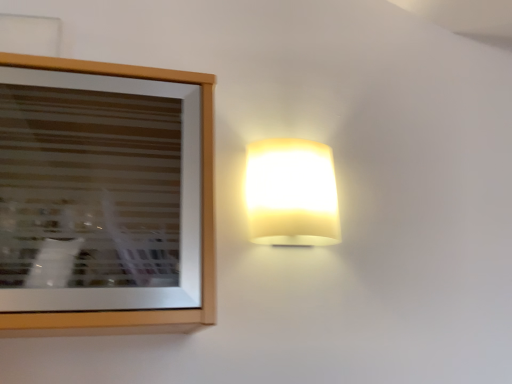
The image size is (512, 384). What do you see at coordinates (291, 193) in the screenshot?
I see `matte yellow glass lamp at upper right` at bounding box center [291, 193].

I want to click on matte yellow glass lamp at upper right, so click(291, 193).

In order to face wooden picture frame at upper left, should I rotate leftwards or rightwards?

Rotate your view left by about 22.306°.

At what (x,y) coordinates should I click in order to perform the action: click on wooden picture frame at upper left. Please return your answer as a coordinate pair (x, y). Looking at the image, I should click on (201, 207).

This screenshot has height=384, width=512. What do you see at coordinates (201, 207) in the screenshot? I see `wooden picture frame at upper left` at bounding box center [201, 207].

Locate an element on the screen. Image resolution: width=512 pixels, height=384 pixels. matte yellow glass lamp at upper right is located at coordinates (291, 193).

Would you say matte yellow glass lamp at upper right is to the left or to the right of wooden picture frame at upper left in the picture?

matte yellow glass lamp at upper right is positioned on wooden picture frame at upper left's right side.

Is the depth of matte yellow glass lamp at upper right greater than that of wooden picture frame at upper left?

That is True.

Which point is more forward, (316, 244) or (209, 99)?

The point (209, 99) is in front.

From the image's perspective, is matte yellow glass lamp at upper right above or below wooden picture frame at upper left?

From the image's perspective, matte yellow glass lamp at upper right appears above wooden picture frame at upper left.

From a real-world perspective, is matte yellow glass lamp at upper right physically located above or below wooden picture frame at upper left?

From a real-world perspective, matte yellow glass lamp at upper right is physically above wooden picture frame at upper left.

Does matte yellow glass lamp at upper right have a lesser width compared to wooden picture frame at upper left?

Correct, the width of matte yellow glass lamp at upper right is less than that of wooden picture frame at upper left.

Can you confirm if matte yellow glass lamp at upper right is shorter than wooden picture frame at upper left?

Indeed, matte yellow glass lamp at upper right has a lesser height compared to wooden picture frame at upper left.

Is matte yellow glass lamp at upper right bigger than wooden picture frame at upper left?

No, matte yellow glass lamp at upper right is not bigger than wooden picture frame at upper left.

Is matte yellow glass lamp at upper right positioned beyond the bounds of wooden picture frame at upper left?

Yes, matte yellow glass lamp at upper right is not within wooden picture frame at upper left.

Is matte yellow glass lamp at upper right positioned far away from wooden picture frame at upper left?

matte yellow glass lamp at upper right is actually quite close to wooden picture frame at upper left.

Does matte yellow glass lamp at upper right turn towards wooden picture frame at upper left?

No, matte yellow glass lamp at upper right is not oriented towards wooden picture frame at upper left.

The image size is (512, 384). Identify the location of lamp lying behind the wooden picture frame at upper left. (291, 193).

Is wooden picture frame at upper left to the left or to the right of matte yellow glass lamp at upper right in the image?

From the image, it's evident that wooden picture frame at upper left is to the left of matte yellow glass lamp at upper right.

Which object is closer to the camera, wooden picture frame at upper left or matte yellow glass lamp at upper right?

wooden picture frame at upper left is closer to the camera.

Considering the positions of point (206, 250) and point (321, 190), is point (206, 250) closer or farther from the camera than point (321, 190)?

Point (206, 250).

From the image's perspective, which object appears higher, wooden picture frame at upper left or matte yellow glass lamp at upper right?

matte yellow glass lamp at upper right is shown above in the image.

From a real-world perspective, is wooden picture frame at upper left under matte yellow glass lamp at upper right?

Correct, in the physical world, wooden picture frame at upper left is lower than matte yellow glass lamp at upper right.

Is wooden picture frame at upper left thinner than matte yellow glass lamp at upper right?

In fact, wooden picture frame at upper left might be wider than matte yellow glass lamp at upper right.

Is wooden picture frame at upper left shorter than matte yellow glass lamp at upper right?

Incorrect, the height of wooden picture frame at upper left does not fall short of that of matte yellow glass lamp at upper right.

Considering the sizes of objects wooden picture frame at upper left and matte yellow glass lamp at upper right in the image provided, who is bigger, wooden picture frame at upper left or matte yellow glass lamp at upper right?

wooden picture frame at upper left.

Is wooden picture frame at upper left spatially inside matte yellow glass lamp at upper right, or outside of it?

wooden picture frame at upper left lies outside matte yellow glass lamp at upper right.

Is wooden picture frame at upper left in contact with matte yellow glass lamp at upper right?

wooden picture frame at upper left is not next to matte yellow glass lamp at upper right, and they're not touching.

Is wooden picture frame at upper left positioned with its back to matte yellow glass lamp at upper right?

That's not correct — wooden picture frame at upper left is not looking away from matte yellow glass lamp at upper right.

How many degrees apart are the facing directions of wooden picture frame at upper left and matte yellow glass lamp at upper right?

The facing directions of wooden picture frame at upper left and matte yellow glass lamp at upper right are 0.00104 degrees apart.

Identify the location of picture frame in front of the matte yellow glass lamp at upper right. Image resolution: width=512 pixels, height=384 pixels. (201, 207).

The height and width of the screenshot is (384, 512). What are the coordinates of `lamp that appears behind the wooden picture frame at upper left` in the screenshot? It's located at (291, 193).

Where is `picture frame beneath the matte yellow glass lamp at upper right (from a real-world perspective)`? This screenshot has width=512, height=384. picture frame beneath the matte yellow glass lamp at upper right (from a real-world perspective) is located at coordinates (201, 207).